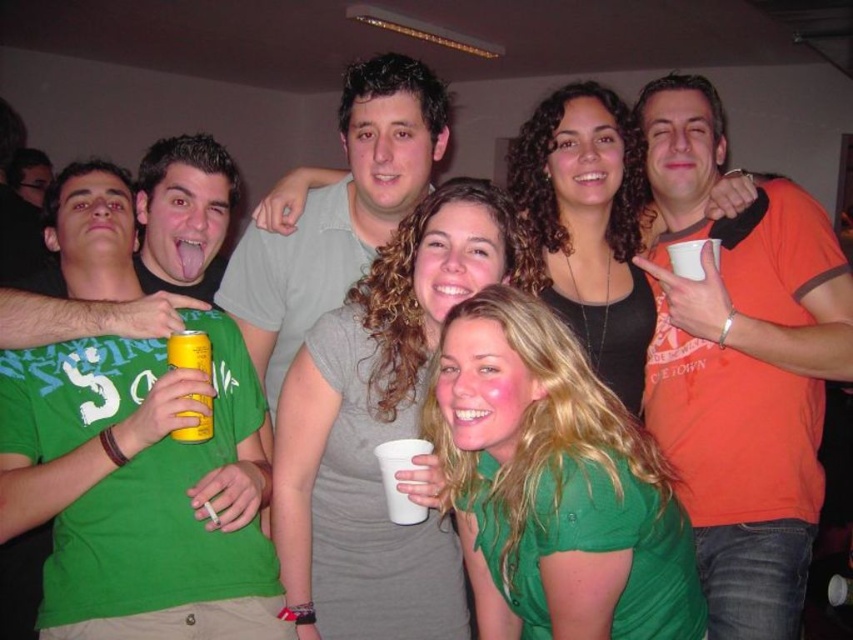
Question: Among these objects, which one is nearest to the camera?

Choices:
 (A) light gray t-shirt at center
 (B) green matte shirt at center
 (C) green cotton t-shirt at left
 (D) white styrofoam cup at center

Answer: (B)

Question: Is gray matte dress at center below white paper cup at upper center?

Choices:
 (A) yes
 (B) no

Answer: (A)

Question: Does orange cotton t-shirt at center have a smaller size compared to yellow metallic can at lower left?

Choices:
 (A) yes
 (B) no

Answer: (B)

Question: Is green cotton t-shirt at left positioned behind yellow metallic can at lower left?

Choices:
 (A) no
 (B) yes

Answer: (A)

Question: Among these objects, which one is farthest from the camera?

Choices:
 (A) orange cotton t-shirt at center
 (B) light gray t-shirt at center
 (C) white styrofoam cup at center

Answer: (B)

Question: Which point is farther from the camera taking this photo?

Choices:
 (A) (741, 269)
 (B) (718, 262)
 (C) (383, 500)

Answer: (A)